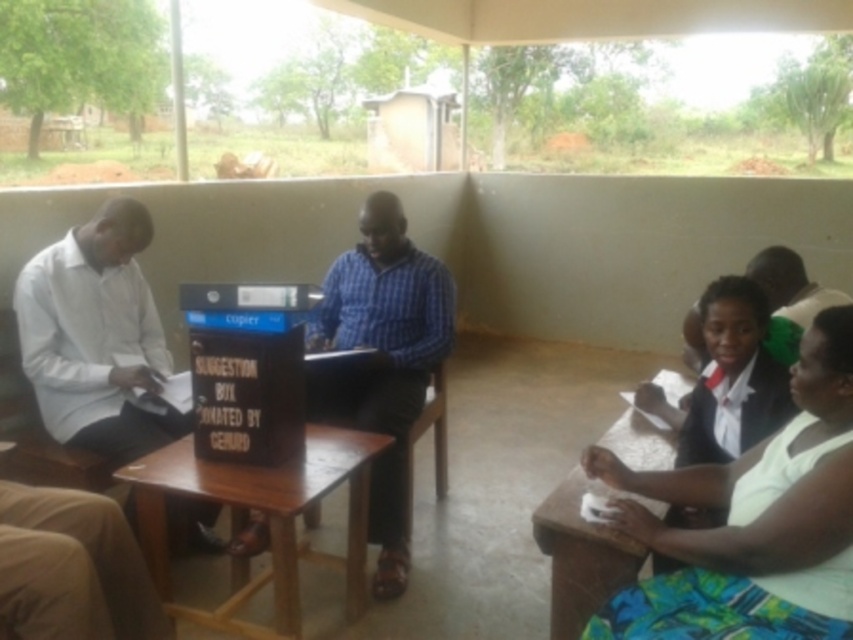
Does white fabric dress at lower right have a larger size compared to wooden table at lower right?

Incorrect, white fabric dress at lower right is not larger than wooden table at lower right.

Does point (700, 499) lie behind point (625, 413)?

No.

Identify the location of white fabric dress at lower right. (752, 522).

Between white fabric dress at lower right and brown wooden table at center, which one has less height?

Standing shorter between the two is brown wooden table at center.

Is white fabric dress at lower right to the left of brown wooden table at center from the viewer's perspective?

In fact, white fabric dress at lower right is to the right of brown wooden table at center.

Is point (608, 460) farther from camera compared to point (291, 506)?

Yes, it is behind point (291, 506).

Where is `white fabric dress at lower right`? white fabric dress at lower right is located at coordinates (752, 522).

Is white matte shirt at left wider than blue plaid shirt at center?

Yes, white matte shirt at left is wider than blue plaid shirt at center.

Can you confirm if white matte shirt at left is shorter than blue plaid shirt at center?

Correct, white matte shirt at left is not as tall as blue plaid shirt at center.

The image size is (853, 640). I want to click on white matte shirt at left, so click(96, 337).

The image size is (853, 640). I want to click on white matte shirt at left, so click(96, 337).